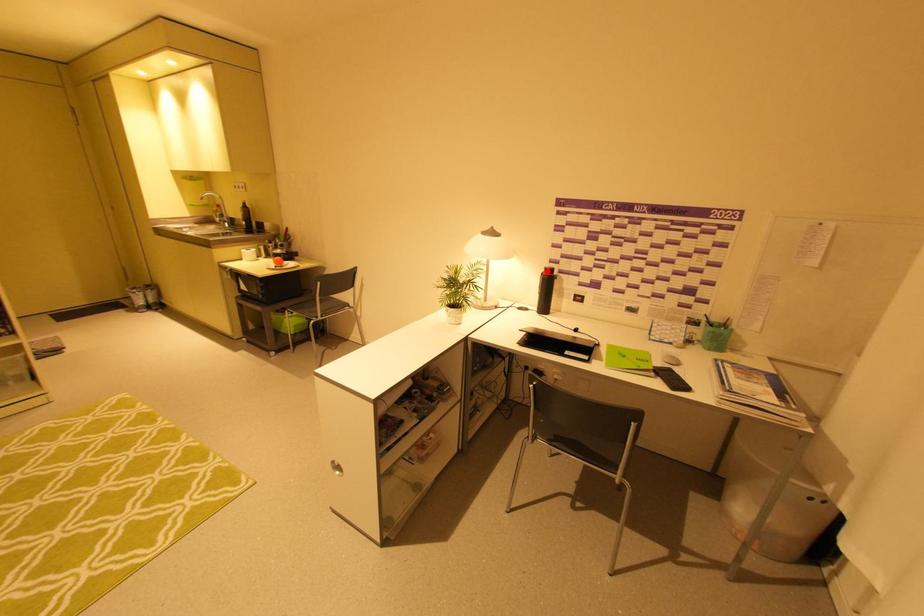
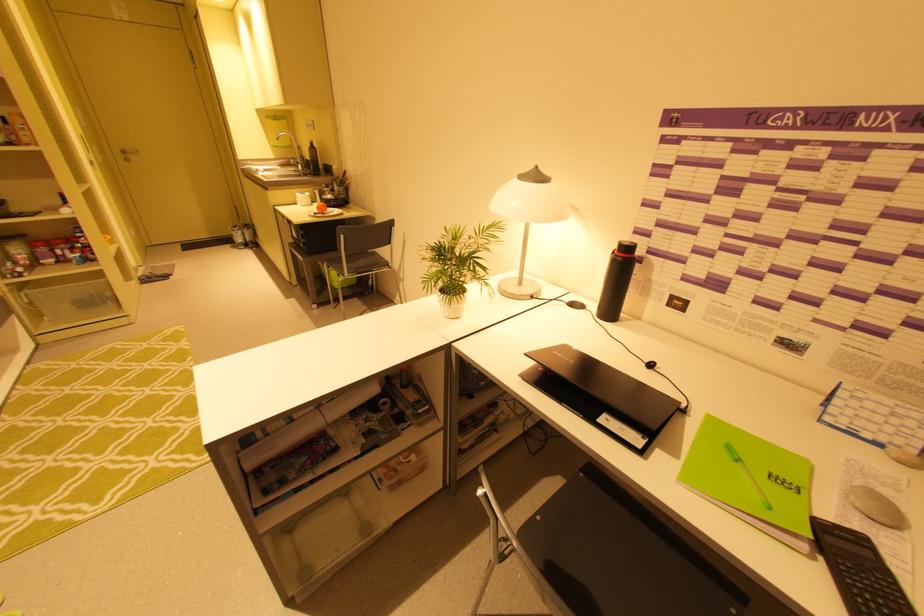
Where in the second image is the point corresponding to the highlighted location from the first image?

(619, 248)